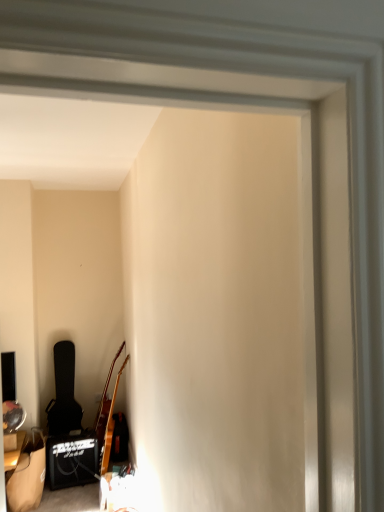
Measure the distance between point (125, 362) and camera.

3.45 meters.

What do you see at coordinates (110, 426) in the screenshot?
I see `wooden acoustic guitar at lower left` at bounding box center [110, 426].

This screenshot has height=512, width=384. What are the coordinates of `wooden acoustic guitar at lower left` in the screenshot? It's located at (110, 426).

This screenshot has height=512, width=384. Describe the element at coordinates (64, 393) in the screenshot. I see `black textured guitar case at left` at that location.

Identify the location of black textured guitar case at left. Image resolution: width=384 pixels, height=512 pixels. (64, 393).

This screenshot has width=384, height=512. Find the location of `wooden acoustic guitar at lower left`. wooden acoustic guitar at lower left is located at coordinates (110, 426).

Is black textured guitar case at left to the right of wooden acoustic guitar at lower left from the viewer's perspective?

No, black textured guitar case at left is not to the right of wooden acoustic guitar at lower left.

Which object is more forward, black textured guitar case at left or wooden acoustic guitar at lower left?

wooden acoustic guitar at lower left is closer to the camera.

Is point (50, 413) behind point (125, 361)?

Yes, it is behind point (125, 361).

From the image's perspective, is black textured guitar case at left located above or below wooden acoustic guitar at lower left?

From the image's perspective, black textured guitar case at left appears above wooden acoustic guitar at lower left.

From a real-world perspective, is black textured guitar case at left below wooden acoustic guitar at lower left?

No.

Which object is wider, black textured guitar case at left or wooden acoustic guitar at lower left?

black textured guitar case at left is wider.

Looking at this image, between black textured guitar case at left and wooden acoustic guitar at lower left, which one has more height?

wooden acoustic guitar at lower left is taller.

Based on the photo, is black textured guitar case at left smaller than wooden acoustic guitar at lower left?

Actually, black textured guitar case at left might be larger than wooden acoustic guitar at lower left.

Would you say black textured guitar case at left contains wooden acoustic guitar at lower left?

No, wooden acoustic guitar at lower left is not inside black textured guitar case at left.

Does black textured guitar case at left touch wooden acoustic guitar at lower left?

They are not placed beside each other.

Does black textured guitar case at left turn towards wooden acoustic guitar at lower left?

No, black textured guitar case at left does not turn towards wooden acoustic guitar at lower left.

What's the angular difference between black textured guitar case at left and wooden acoustic guitar at lower left's facing directions?

The angle between the facing direction of black textured guitar case at left and the facing direction of wooden acoustic guitar at lower left is 93.6 degrees.

Measure the distance from black textured guitar case at left to wooden acoustic guitar at lower left.

black textured guitar case at left is 19.92 inches from wooden acoustic guitar at lower left.

At what (x,y) coordinates should I click in order to perform the action: click on guitar that appears below the black textured guitar case at left (from the image's perspective). Please return your answer as a coordinate pair (x, y). Looking at the image, I should click on (110, 426).

Considering the positions of objects wooden acoustic guitar at lower left and black textured guitar case at left in the image provided, who is more to the right, wooden acoustic guitar at lower left or black textured guitar case at left?

wooden acoustic guitar at lower left.

Is wooden acoustic guitar at lower left positioned behind black textured guitar case at left?

No, it is in front of black textured guitar case at left.

Considering the positions of point (107, 442) and point (49, 409), is point (107, 442) closer or farther from the camera than point (49, 409)?

Point (107, 442) appears to be closer to the viewer than point (49, 409).

From the image's perspective, which one is positioned higher, wooden acoustic guitar at lower left or black textured guitar case at left?

black textured guitar case at left.

From a real-world perspective, is wooden acoustic guitar at lower left positioned under black textured guitar case at left based on gravity?

Yes, from a real-world perspective, wooden acoustic guitar at lower left is beneath black textured guitar case at left.

Based on the photo, can you confirm if wooden acoustic guitar at lower left is wider than black textured guitar case at left?

Incorrect, the width of wooden acoustic guitar at lower left does not surpass that of black textured guitar case at left.

In terms of height, does wooden acoustic guitar at lower left look taller or shorter compared to black textured guitar case at left?

wooden acoustic guitar at lower left is taller than black textured guitar case at left.

Between wooden acoustic guitar at lower left and black textured guitar case at left, which one has larger size?

black textured guitar case at left is bigger.

Is wooden acoustic guitar at lower left positioned beyond the bounds of black textured guitar case at left?

Yes, wooden acoustic guitar at lower left is located beyond the bounds of black textured guitar case at left.

Does wooden acoustic guitar at lower left touch black textured guitar case at left?

wooden acoustic guitar at lower left and black textured guitar case at left are not in contact.

Could you tell me if wooden acoustic guitar at lower left is turned towards black textured guitar case at left?

No, wooden acoustic guitar at lower left is not facing towards black textured guitar case at left.

I want to click on chair located behind the wooden acoustic guitar at lower left, so click(x=64, y=393).

Find the location of a particular element. The image size is (384, 512). chair above the wooden acoustic guitar at lower left (from the image's perspective) is located at coordinates (64, 393).

Locate an element on the screen. Image resolution: width=384 pixels, height=512 pixels. chair on the left of the wooden acoustic guitar at lower left is located at coordinates (64, 393).